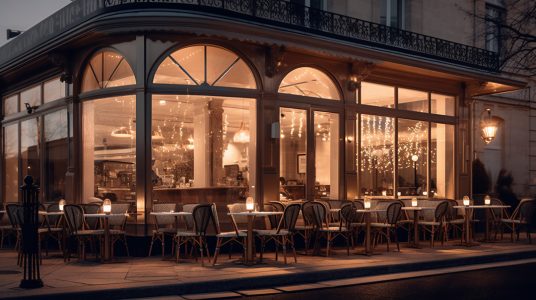
The width and height of the screenshot is (536, 300). Identify the location of 8 triangle shaped windows. (91, 79), (95, 63), (107, 62), (118, 75), (174, 75), (189, 53), (211, 52), (249, 73).